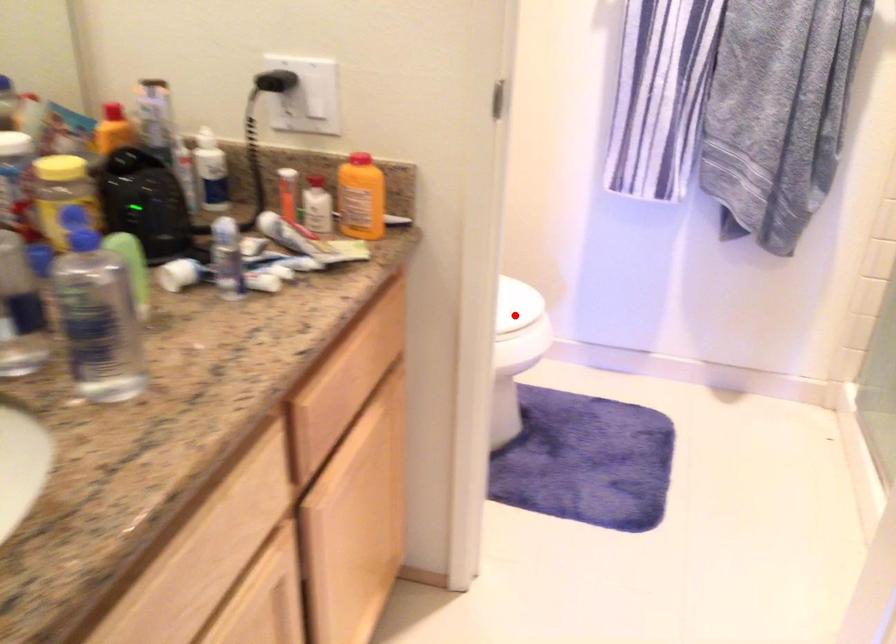
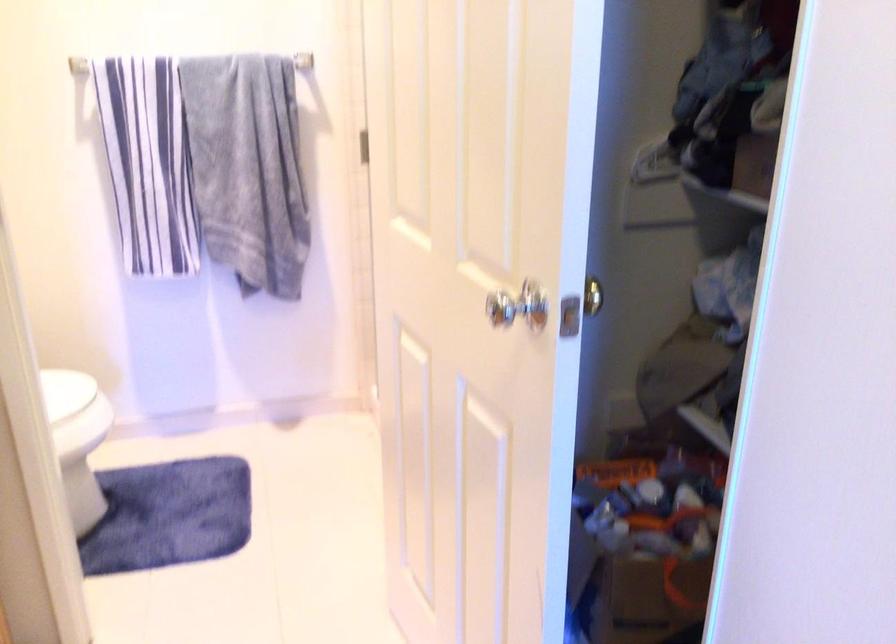
Locate, in the second image, the point that corresponds to the highlighted location in the first image.

(72, 400)